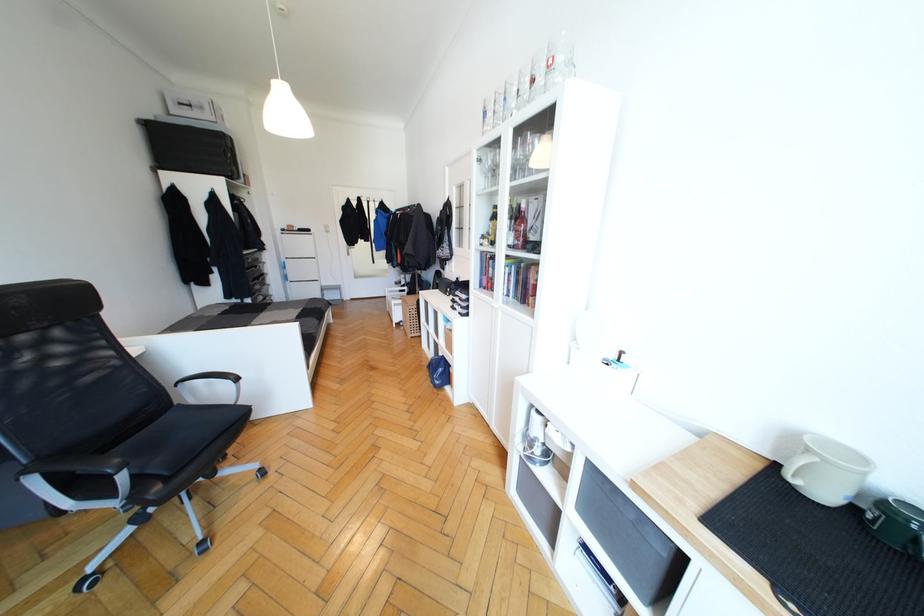
Describe the element at coordinates (213, 379) in the screenshot. I see `the black chair armrest` at that location.